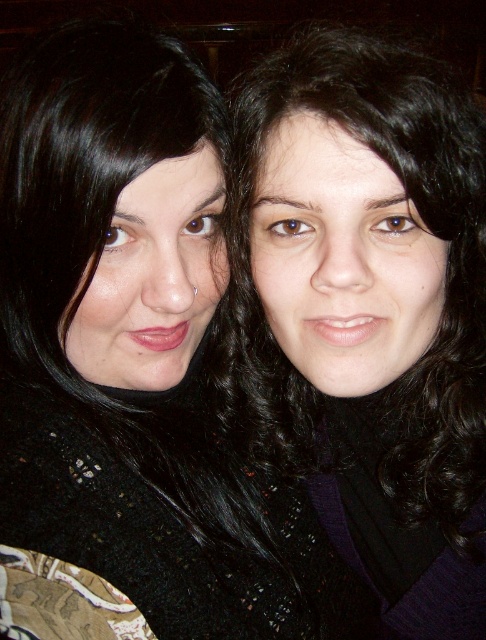
You are taking a photo of two people in a dimly lit indoor setting. You notice two points in the image labeled as point 1 at coordinates (107, 284) and point 2 at coordinates (371, 61). Based on their positions, which point is closer to you, the photographer?

Point 1 at coordinates (107, 284) is closer to you than point 2 at coordinates (371, 61) because it is further to the viewer according to the description.

Consider the image. You are a photographer trying to adjust the framing of a portrait. You notice two people in the image with black matte hair at center and black curly hair at upper right. Given that the minimum distance required for proper focus is 6 inches, will the current spacing between them allow both subjects to be in focus?

The black matte hair at center and black curly hair at upper right are 5.49 inches apart, which is less than the required 6 inches for proper focus. Therefore, the current spacing may not ensure both subjects are in focus.

You are a photographer trying to focus on the black matte hair at center. Based on the scene description, where should you adjust your camera focus to capture this detail?

The black matte hair at center is located at point (134, 368), so you should adjust your camera focus to that coordinate to capture the detail.